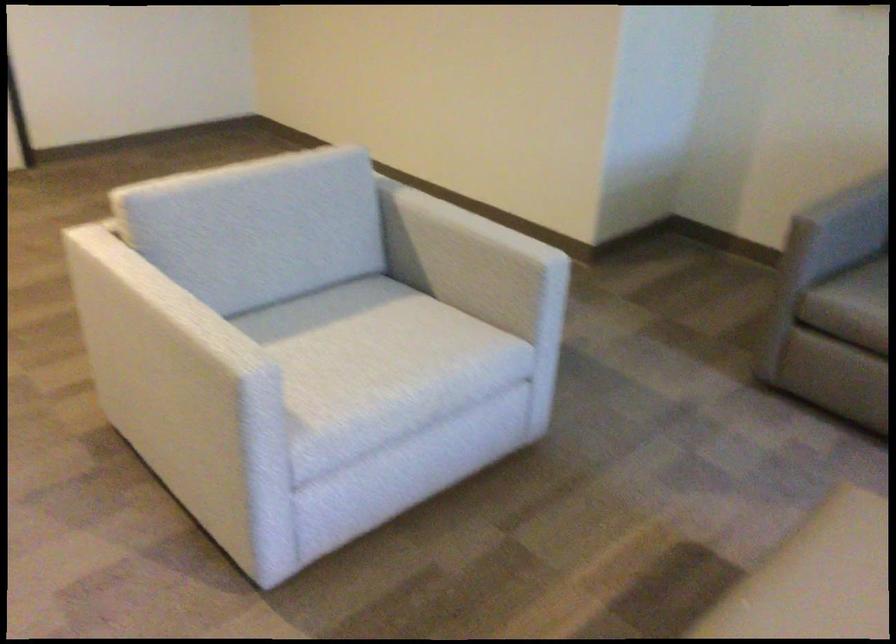
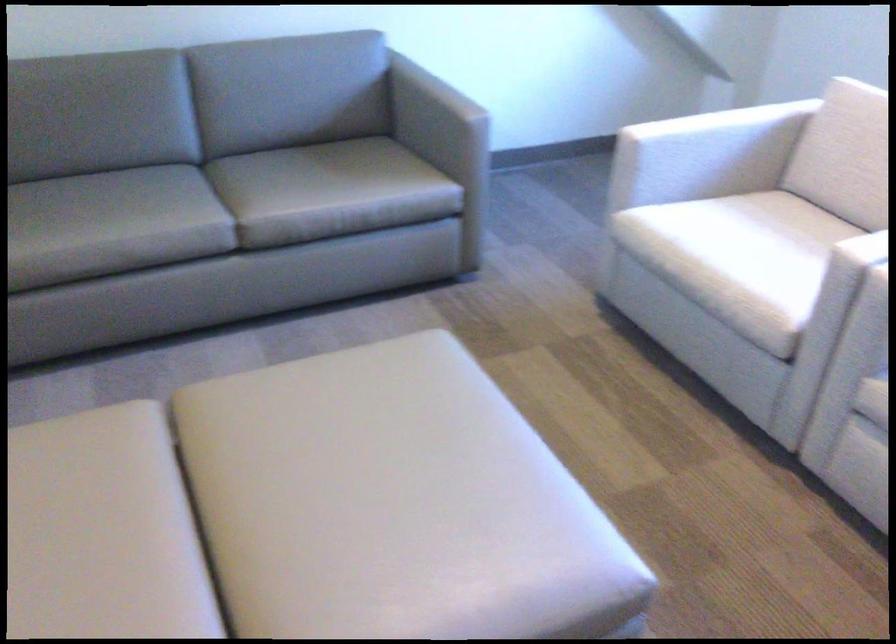
First-person continuous shooting, in which direction is the camera rotating?

The rotation direction of the camera is right-down.